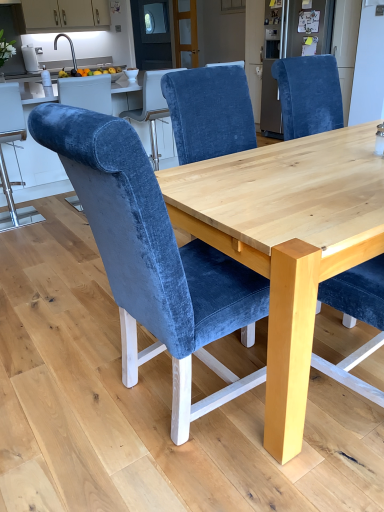
You are a GUI agent. You are given a task and a screenshot of the screen. Output one action in this format:
    pyautogui.click(x=<x>, y=<y>)
    Task: Click on the vacant area that is in front of velvet blue chair at left, acting as the third chair starting from the front
    This screenshot has height=512, width=384.
    Given the screenshot: What is the action you would take?
    pyautogui.click(x=24, y=241)